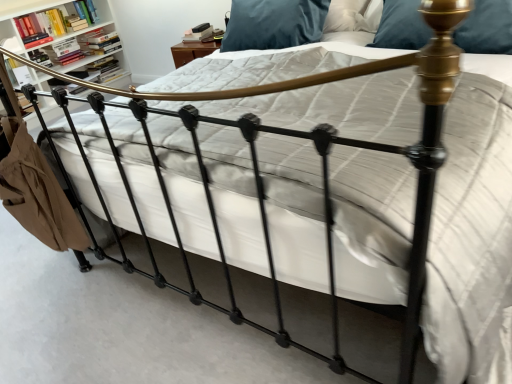
Question: From a real-world perspective, is metallic bookshelf at upper left physically above hardcover books at upper left, placed as the fourth book when sorted from front to back?

Choices:
 (A) no
 (B) yes

Answer: (B)

Question: Considering the relative sizes of metallic bookshelf at upper left and hardcover books at upper left, placed as the fourth book when sorted from front to back, in the image provided, is metallic bookshelf at upper left wider than hardcover books at upper left, placed as the fourth book when sorted from front to back,?

Choices:
 (A) no
 (B) yes

Answer: (B)

Question: From the image's perspective, would you say metallic bookshelf at upper left is positioned over hardcover books at upper left, which is counted as the 1th book, starting from the back?

Choices:
 (A) no
 (B) yes

Answer: (A)

Question: Does metallic bookshelf at upper left have a greater height compared to hardcover books at upper left, placed as the fourth book when sorted from front to back?

Choices:
 (A) no
 (B) yes

Answer: (B)

Question: Is metallic bookshelf at upper left in contact with hardcover books at upper left, which is counted as the 1th book, starting from the back?

Choices:
 (A) no
 (B) yes

Answer: (A)

Question: From a real-world perspective, is hardcover book at upper left, the 3th book from the front, positioned above or below velvet blue pillow at upper right?

Choices:
 (A) above
 (B) below

Answer: (B)

Question: Is point (78, 44) closer or farther from the camera than point (475, 1)?

Choices:
 (A) farther
 (B) closer

Answer: (A)

Question: In terms of height, does hardcover book at upper left, which is the 2th book in back-to-front order, look taller or shorter compared to velvet blue pillow at upper right?

Choices:
 (A) tall
 (B) short

Answer: (B)

Question: Is hardcover book at upper left, which is the 2th book in back-to-front order, to the left or to the right of velvet blue pillow at upper right in the image?

Choices:
 (A) right
 (B) left

Answer: (B)

Question: Visually, is velvet blue pillow at upper right positioned to the left or to the right of hardcover books at upper left, placed as the fourth book when sorted from front to back?

Choices:
 (A) right
 (B) left

Answer: (A)

Question: From a real-world perspective, is velvet blue pillow at upper right positioned above or below hardcover books at upper left, placed as the fourth book when sorted from front to back?

Choices:
 (A) above
 (B) below

Answer: (A)

Question: In the image, is velvet blue pillow at upper right positioned in front of or behind hardcover books at upper left, which is counted as the 1th book, starting from the back?

Choices:
 (A) behind
 (B) front

Answer: (B)

Question: In terms of size, does velvet blue pillow at upper right appear bigger or smaller than hardcover books at upper left, which is counted as the 1th book, starting from the back?

Choices:
 (A) small
 (B) big

Answer: (B)

Question: Considering their positions, is hardcover books at upper left, which is counted as the 1th book, starting from the back, located in front of or behind hardcover book at upper left, marked as the 2th book in a front-to-back arrangement?

Choices:
 (A) behind
 (B) front

Answer: (A)

Question: In terms of height, does hardcover books at upper left, placed as the fourth book when sorted from front to back, look taller or shorter compared to hardcover book at upper left, which is the 3th book in back-to-front order?

Choices:
 (A) short
 (B) tall

Answer: (A)